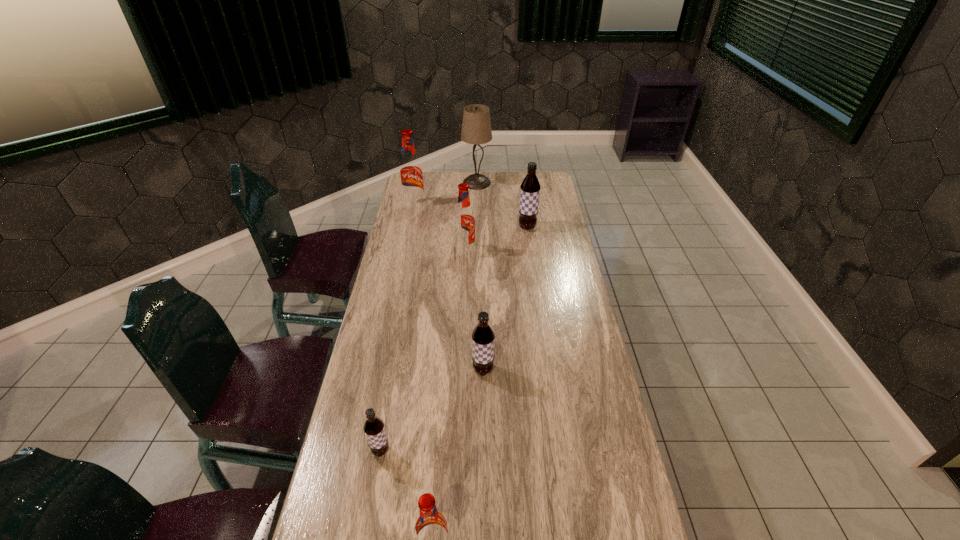
Identify which root beer is the fifth closest to the farthest brown root beer. Please provide its 2D coordinates. Your answer should be formatted as a tuple, i.e. [(x, y)], where the tuple contains the x and y coordinates of a point satisfying the conditions above.

[(431, 530)]

You are a GUI agent. You are given a task and a screenshot of the screen. Output one action in this format:
    pyautogui.click(x=<x>, y=<y>)
    Task: Click on the second closest red root beer relative to the fourth nearest object
    
    Given the screenshot: What is the action you would take?
    pyautogui.click(x=431, y=530)

The height and width of the screenshot is (540, 960). I want to click on the second closest red root beer to the farthest object, so click(464, 220).

Select which brown root beer appears as the second closest to the nearest red root beer. Please provide its 2D coordinates. Your answer should be formatted as a tuple, i.e. [(x, y)], where the tuple contains the x and y coordinates of a point satisfying the conditions above.

[(483, 336)]

Identify the location of brown root beer that stands as the second closest to the biggest brown root beer. This screenshot has height=540, width=960. (374, 429).

This screenshot has width=960, height=540. I want to click on vacant space that satisfies the following two spatial constraints: 1. on the back side of the shortest object; 2. on the right side of the rightmost root beer, so click(x=420, y=227).

At what (x,y) coordinates should I click in order to perform the action: click on free spot that satisfies the following two spatial constraints: 1. on the back side of the smallest brown root beer; 2. on the left side of the second farthest red root beer. Please return your answer as a coordinate pair (x, y). The image size is (960, 540). Looking at the image, I should click on (417, 251).

You are a GUI agent. You are given a task and a screenshot of the screen. Output one action in this format:
    pyautogui.click(x=<x>, y=<y>)
    Task: Click on the vacant space that satisfies the following two spatial constraints: 1. on the front-facing side of the lampshade; 2. on the right side of the second biggest brown root beer
    The image size is (960, 540).
    Given the screenshot: What is the action you would take?
    pyautogui.click(x=475, y=370)